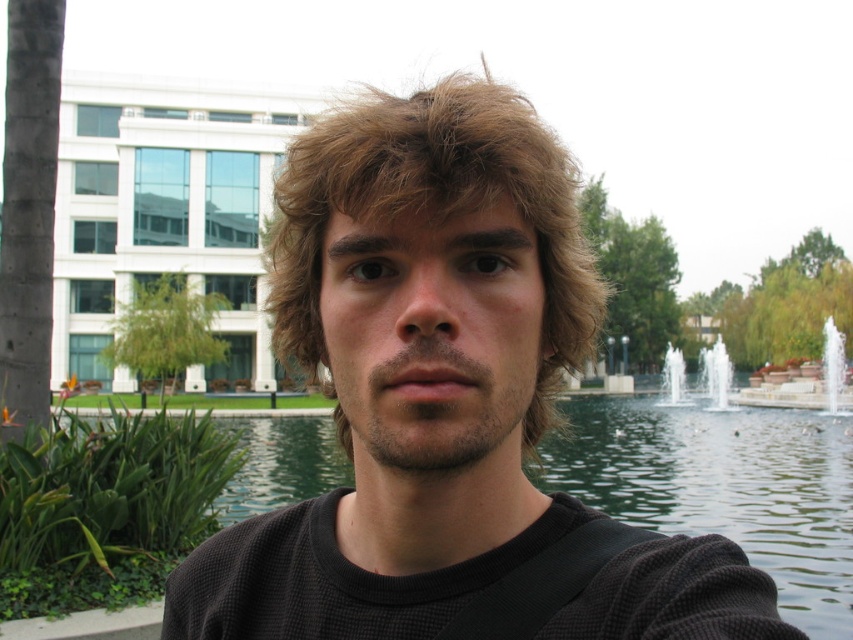
Question: Which object appears closest to the camera in this image?

Choices:
 (A) brownwoollyhair at center
 (B) clear glass water at center
 (C) black mesh shirt at center

Answer: (C)

Question: Which object is farther from the camera taking this photo?

Choices:
 (A) white stone fountain at center
 (B) clear glass water at center

Answer: (A)

Question: Can you confirm if green water at center is thinner than clear glass water at center?

Choices:
 (A) yes
 (B) no

Answer: (B)

Question: Estimate the real-world distances between objects in this image. Which object is closer to the white glossy water at center?

Choices:
 (A) clear glass water at center
 (B) green water at center

Answer: (A)

Question: Is white frothy water at center right thinner than white stone fountain at center?

Choices:
 (A) no
 (B) yes

Answer: (A)

Question: Can you confirm if black mesh shirt at center is smaller than white stone fountain at center?

Choices:
 (A) no
 (B) yes

Answer: (B)